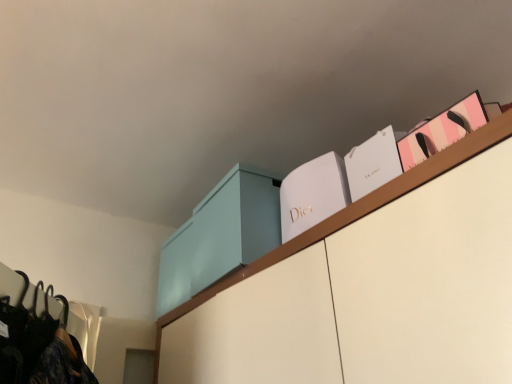
Question: Is white matte dior box at upper center, marked as the 3th book in a right-to-left arrangement, wider or thinner than light blue matte cabinet at upper center?

Choices:
 (A) thin
 (B) wide

Answer: (A)

Question: Is point pos(305,172) positioned closer to the camera than point pos(208,253)?

Choices:
 (A) farther
 (B) closer

Answer: (B)

Question: Based on their relative distances, which object is nearer to the light blue matte cabinet at upper center?

Choices:
 (A) white paper bag at upper right, the 2th book in the left-to-right sequence
 (B) white matte dior box at upper center, which appears as the first book when viewed from the left
 (C) pink paper bag at upper right, the 3th book from the left

Answer: (B)

Question: Which of these objects is positioned closest to the light blue matte cabinet at upper center?

Choices:
 (A) pink paper bag at upper right, the 3th book from the left
 (B) white paper bag at upper right, marked as the 2th book in a right-to-left arrangement
 (C) white matte dior box at upper center, marked as the 3th book in a right-to-left arrangement

Answer: (C)